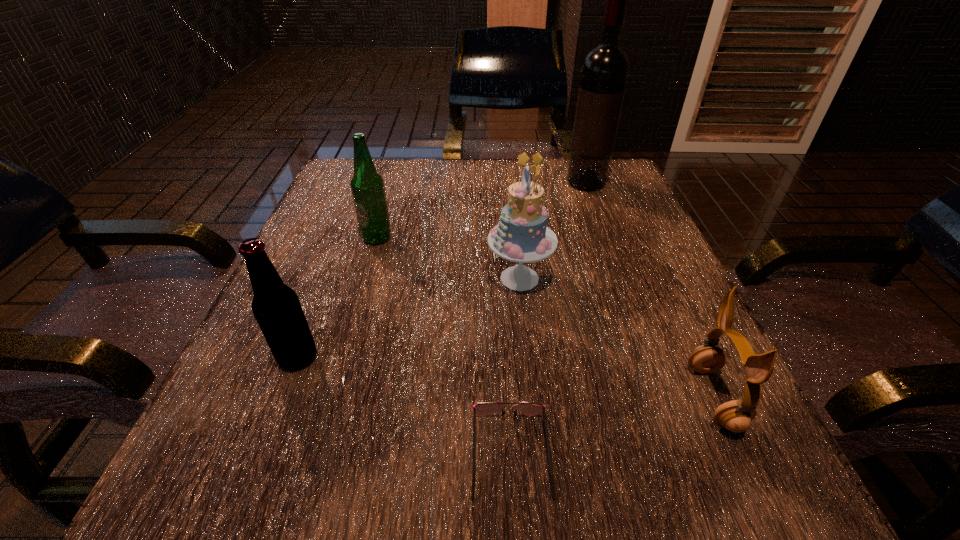
Where is `free space between the sunglasses and the third farthest object`? The width and height of the screenshot is (960, 540). free space between the sunglasses and the third farthest object is located at coordinates (516, 366).

You are a GUI agent. You are given a task and a screenshot of the screen. Output one action in this format:
    pyautogui.click(x=<x>, y=<y>)
    Task: Click on the free point between the sunglasses and the tallest object
    The image size is (960, 540).
    Given the screenshot: What is the action you would take?
    pyautogui.click(x=548, y=318)

You are a GUI agent. You are given a task and a screenshot of the screen. Output one action in this format:
    pyautogui.click(x=<x>, y=<y>)
    Task: Click on the free space that is in between the right beer bottle and the shortest object
    This screenshot has height=540, width=960.
    Given the screenshot: What is the action you would take?
    pyautogui.click(x=444, y=346)

This screenshot has width=960, height=540. Find the location of `free space between the left beer bottle and the second shortest object`. free space between the left beer bottle and the second shortest object is located at coordinates (506, 377).

Where is `blank region between the left beer bottle and the wine bottle`? This screenshot has width=960, height=540. blank region between the left beer bottle and the wine bottle is located at coordinates tap(442, 270).

The height and width of the screenshot is (540, 960). I want to click on vacant area that lies between the fifth nearest object and the fourth nearest object, so click(448, 258).

Find the location of `free spot between the third farthest object and the shortest object`. free spot between the third farthest object and the shortest object is located at coordinates [516, 366].

I want to click on free point between the nearer beer bottle and the tallest object, so click(x=442, y=270).

Identify the location of object that is the third closest one to the cake. (482, 408).

Identify the location of object that stands as the second closest to the right beer bottle. This screenshot has width=960, height=540. (276, 307).